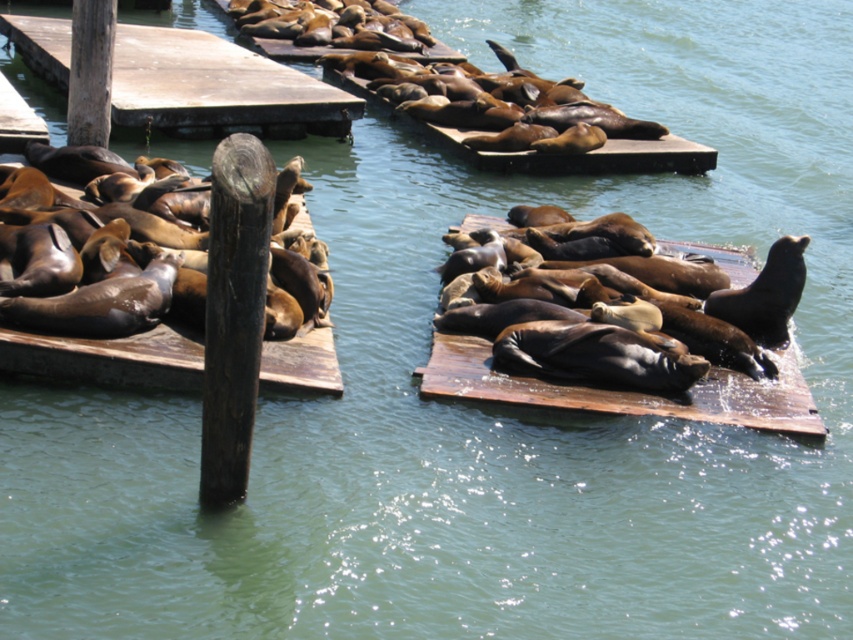
From the picture: You are a marine biologist observing sea lions on wooden platforms. You notice the wooden dock at upper left and the brown wooden dock at left. Which dock is positioned higher in the image?

The wooden dock at upper left is positioned higher in the image as it is above the brown wooden dock at left.